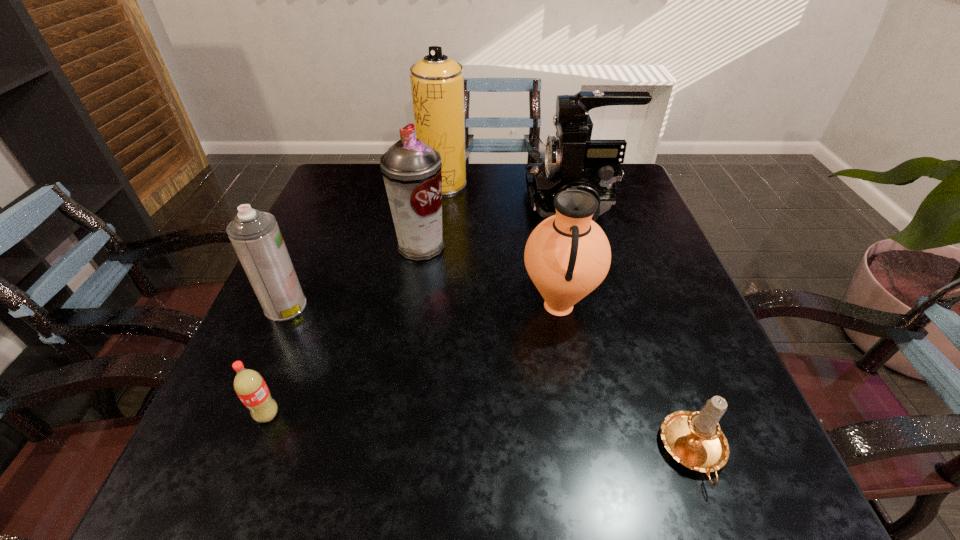
Identify the location of aerosol can identified as the second closest to the tallest aerosol can. The height and width of the screenshot is (540, 960). (257, 240).

Locate which aerosol can is the closest to the candle. Please provide its 2D coordinates. Your answer should be formatted as a tuple, i.e. [(x, y)], where the tuple contains the x and y coordinates of a point satisfying the conditions above.

[(411, 169)]

At what (x,y) coordinates should I click in order to perform the action: click on vacant area that satisfies the following two spatial constraints: 1. on the front side of the second shortest aerosol can; 2. on the left side of the candle. Please return your answer as a coordinate pair (x, y). This screenshot has height=540, width=960. Looking at the image, I should click on (389, 452).

You are a GUI agent. You are given a task and a screenshot of the screen. Output one action in this format:
    pyautogui.click(x=<x>, y=<y>)
    Task: Click on the free space that satisfies the following two spatial constraints: 1. on the front side of the candle; 2. on the right side of the shortest aerosol can
    The height and width of the screenshot is (540, 960).
    Given the screenshot: What is the action you would take?
    pyautogui.click(x=221, y=452)